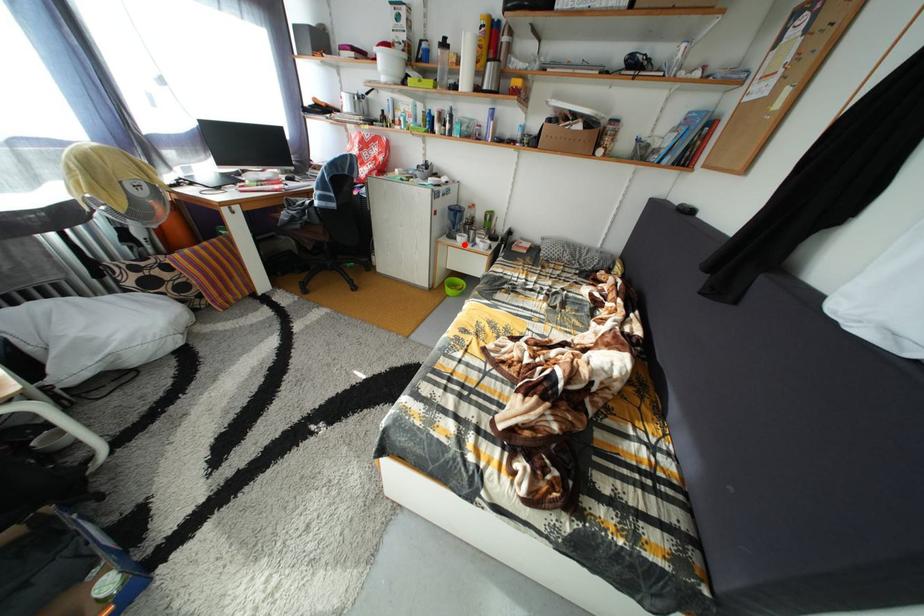
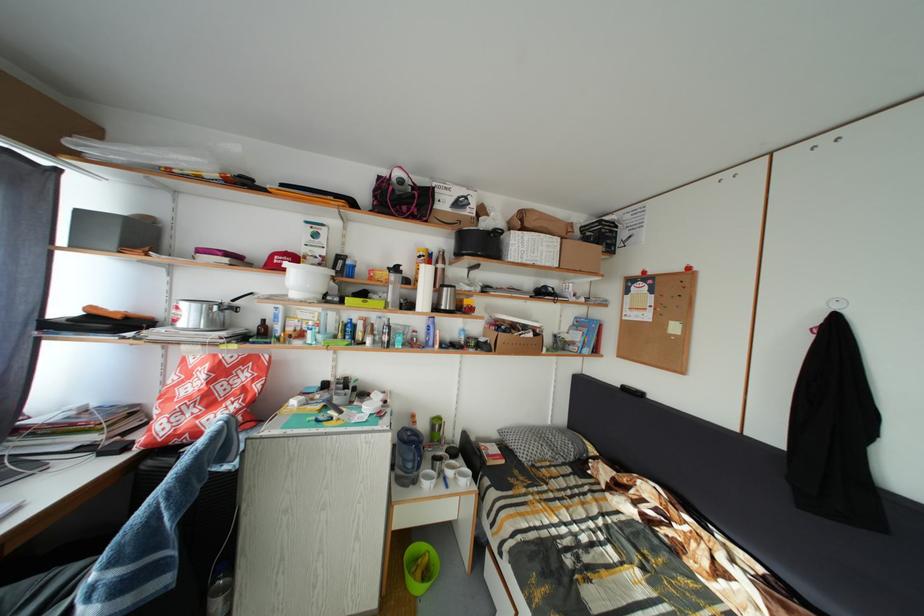
The point at the highlighted location is marked in the first image. Where is the corresponding point in the second image?

(423, 488)